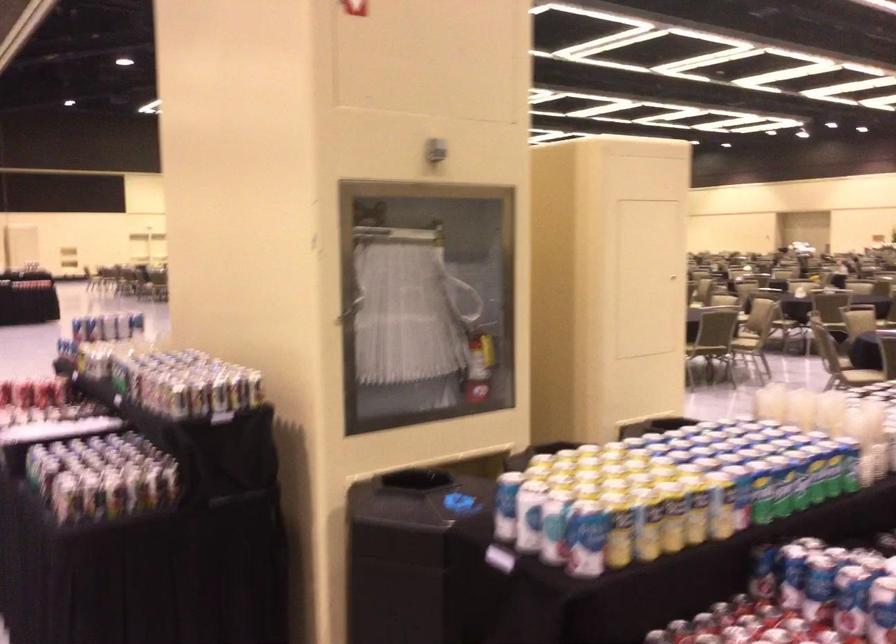
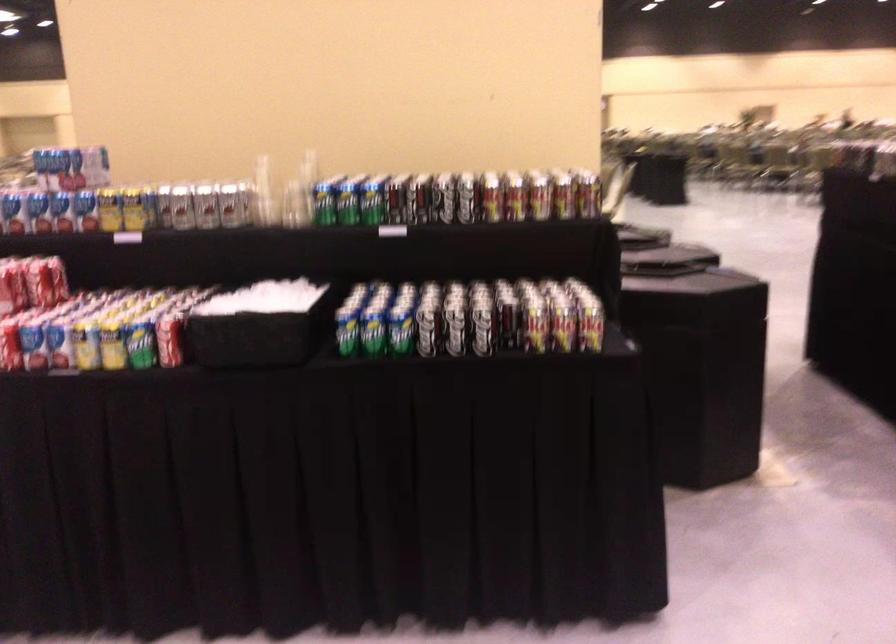
Find the pixel in the second image that matches (x=87, y=328) in the first image.

(39, 211)